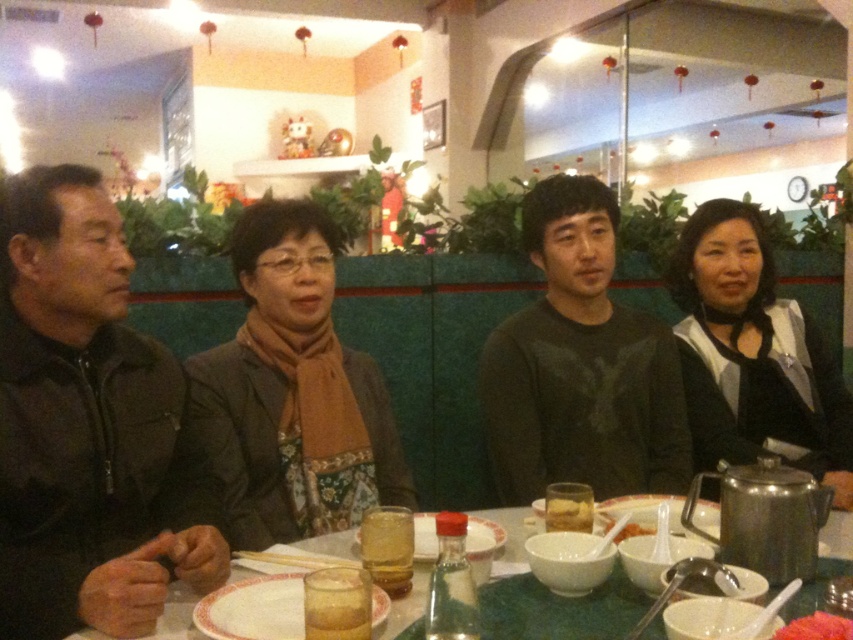
You are a server at a restaurant and need to place a new order for the customer wearing the black matte jacket at right. The plate you have is the same size as the white matte rice bowl at center. Will the plate be large enough to fit the customer?

The black matte jacket at right is wider than the white matte rice bowl at center. Since the plate is the same size as the rice bowl, it may not be large enough to accommodate the customer wearing the black matte jacket at right.

You are a server at the restaurant and need to place a 12 inch long menu between the brown fabric scarf at center and the dark gray sweater at center. Can you fit the menu between them without moving either item?

The brown fabric scarf at center is 18.55 inches from dark gray sweater at center, so yes, the 12 inch long menu can fit between them as there is enough space.

You are a photographer trying to capture a closeup of the dark brown leather jacket at left and the brown fabric scarf at center. Since you want both items to appear similarly sized in the photo, which object should you move closer to the camera?

To make both the dark brown leather jacket at left and the brown fabric scarf at center appear similarly sized in the photo, you should move the dark brown leather jacket at left closer to the camera because it has a lesser width compared to the brown fabric scarf at center.